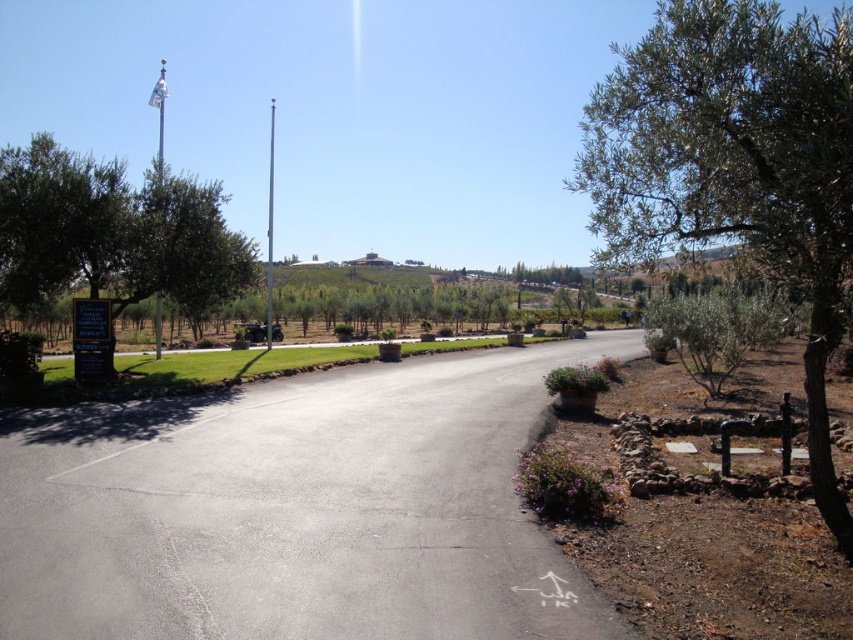
You are standing at the entrance of the winery and see the paved road curving to the right. There is a signboard on the left side of the road and a point marked at coordinates (294,509). What is located at that specific coordinate point?

The point at coordinates (294,509) is occupied by asphalt at center.

You are a visitor at the winery entrance and need to determine which tree is taller between the green leafy olive tree at right and the green leafy tree at left. Based on the scene, which one is taller?

The green leafy olive tree at right is taller than the green leafy tree at left.